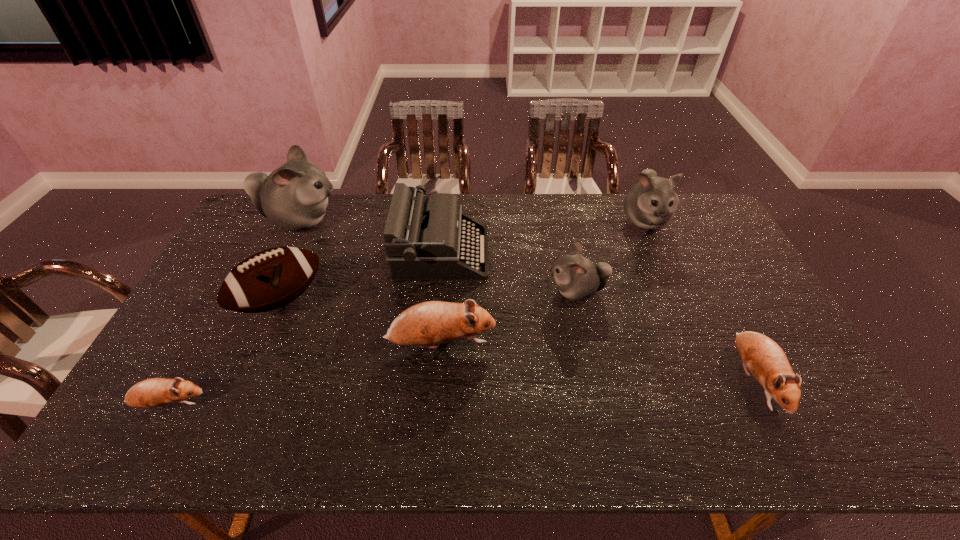
Where is `free location that satisfies the following two spatial constraints: 1. on the face of the rightmost white hamster; 2. on the face of the third farthest hamster`? This screenshot has width=960, height=540. free location that satisfies the following two spatial constraints: 1. on the face of the rightmost white hamster; 2. on the face of the third farthest hamster is located at coordinates (675, 291).